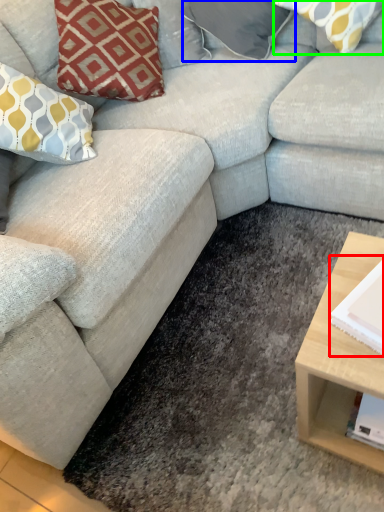
Question: Which is farther away from magazine (highlighted by a red box)? pillow (highlighted by a blue box) or pillow (highlighted by a green box)?

Choices:
 (A) pillow
 (B) pillow

Answer: (A)